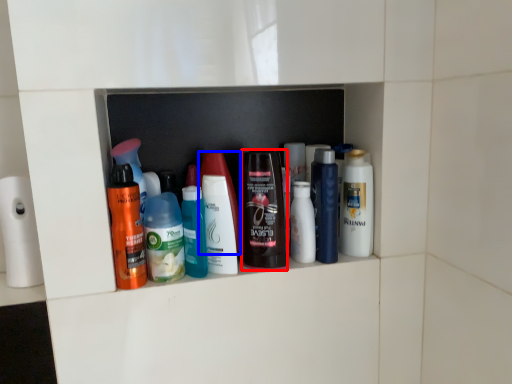
Question: Among these objects, which one is nearest to the camera, toiletry (highlighted by a red box) or toiletry (highlighted by a blue box)?

Choices:
 (A) toiletry
 (B) toiletry

Answer: (B)